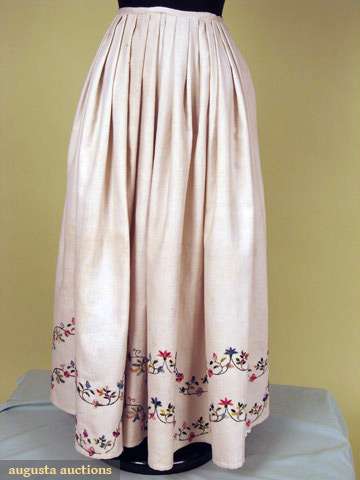
Identify the location of corners of table. The width and height of the screenshot is (360, 480). (31, 370), (324, 388).